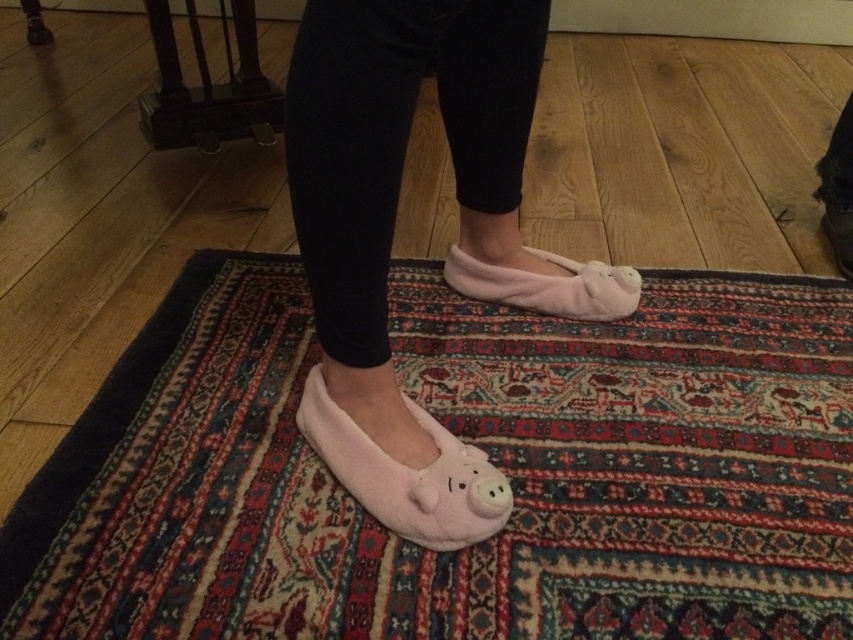
Between point (558, 310) and point (840, 236), which one is positioned in front?

Point (558, 310) is in front.

Is fluffy pink slippers at center to the right of pink fuzzy slipper at lower center from the viewer's perspective?

Incorrect, fluffy pink slippers at center is not on the right side of pink fuzzy slipper at lower center.

Who is more forward, [538,280] or [830,241]?

Point [538,280]

Where is `fluffy pink slippers at center`? The width and height of the screenshot is (853, 640). fluffy pink slippers at center is located at coordinates (548, 285).

Is point (428, 531) closer to camera compared to point (845, 234)?

Yes, it is.

Describe the element at coordinates (408, 474) in the screenshot. I see `fluffy pink slipper at lower center` at that location.

Locate an element on the screen. The height and width of the screenshot is (640, 853). fluffy pink slipper at lower center is located at coordinates (408, 474).

Which of these two, pink fuzzy slippers at center or fluffy pink slippers at center, stands taller?

pink fuzzy slippers at center

Is pink fuzzy slippers at center behind fluffy pink slippers at center?

No, it is not.

What do you see at coordinates (392, 234) in the screenshot? Image resolution: width=853 pixels, height=640 pixels. I see `pink fuzzy slippers at center` at bounding box center [392, 234].

What are the coordinates of `pink fuzzy slippers at center` in the screenshot? It's located at (392, 234).